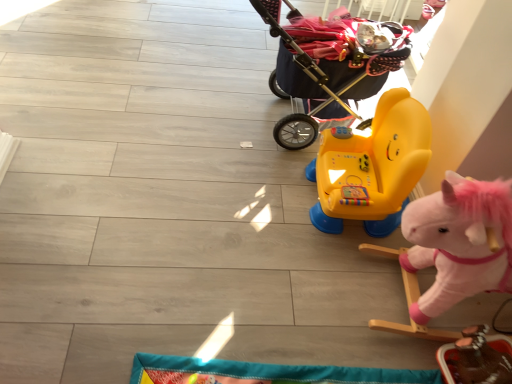
Question: Are fluffy pink rocking horse at right, the 2th toy when ordered from bottom to top, and yellow plastic ride-on toy at center, the 1th toy positioned from the top, making contact?

Choices:
 (A) no
 (B) yes

Answer: (A)

Question: Is fluffy pink rocking horse at right, the 2th toy when ordered from bottom to top, closer to the viewer compared to yellow plastic ride-on toy at center, the 1th toy positioned from the top?

Choices:
 (A) yes
 (B) no

Answer: (A)

Question: Can you confirm if fluffy pink rocking horse at right, the 2th toy when ordered from bottom to top, is smaller than yellow plastic ride-on toy at center, arranged as the 3th toy when ordered from the bottom?

Choices:
 (A) no
 (B) yes

Answer: (A)

Question: Considering the relative sizes of fluffy pink rocking horse at right, the second toy when ordered from top to bottom, and yellow plastic ride-on toy at center, arranged as the 3th toy when ordered from the bottom, in the image provided, is fluffy pink rocking horse at right, the second toy when ordered from top to bottom, shorter than yellow plastic ride-on toy at center, arranged as the 3th toy when ordered from the bottom,?

Choices:
 (A) yes
 (B) no

Answer: (B)

Question: From a real-world perspective, is fluffy pink rocking horse at right, the 2th toy when ordered from bottom to top, under yellow plastic ride-on toy at center, the 1th toy positioned from the top?

Choices:
 (A) yes
 (B) no

Answer: (B)

Question: Considering their positions, is dark blue fabric baby carriage at upper right located in front of or behind yellow plastic ride-on toy at center, the 1th toy positioned from the top?

Choices:
 (A) front
 (B) behind

Answer: (B)

Question: Would you say dark blue fabric baby carriage at upper right is inside or outside yellow plastic ride-on toy at center, arranged as the 3th toy when ordered from the bottom?

Choices:
 (A) inside
 (B) outside

Answer: (B)

Question: From the image's perspective, relative to yellow plastic ride-on toy at center, the 1th toy positioned from the top, is dark blue fabric baby carriage at upper right above or below?

Choices:
 (A) below
 (B) above

Answer: (B)

Question: Based on their positions, is dark blue fabric baby carriage at upper right located to the left or right of yellow plastic ride-on toy at center, arranged as the 3th toy when ordered from the bottom?

Choices:
 (A) right
 (B) left

Answer: (B)

Question: In terms of size, does smooth brown wooden toy at lower right, which is the 3th toy in top-to-bottom order, appear bigger or smaller than fluffy pink rocking horse at right, the 2th toy when ordered from bottom to top?

Choices:
 (A) small
 (B) big

Answer: (A)

Question: Considering the positions of point (461, 342) and point (463, 249), is point (461, 342) closer or farther from the camera than point (463, 249)?

Choices:
 (A) closer
 (B) farther

Answer: (B)

Question: From a real-world perspective, is smooth brown wooden toy at lower right, which is the 3th toy in top-to-bottom order, positioned above or below fluffy pink rocking horse at right, the second toy when ordered from top to bottom?

Choices:
 (A) below
 (B) above

Answer: (A)

Question: Is smooth brown wooden toy at lower right, which is the 3th toy in top-to-bottom order, in front of or behind fluffy pink rocking horse at right, the 2th toy when ordered from bottom to top, in the image?

Choices:
 (A) behind
 (B) front

Answer: (A)

Question: In the image, is smooth brown wooden toy at lower right, placed as the first toy when sorted from bottom to top, on the left side or the right side of dark blue fabric baby carriage at upper right?

Choices:
 (A) left
 (B) right

Answer: (B)

Question: Is point (481, 329) positioned closer to the camera than point (305, 122)?

Choices:
 (A) farther
 (B) closer

Answer: (B)